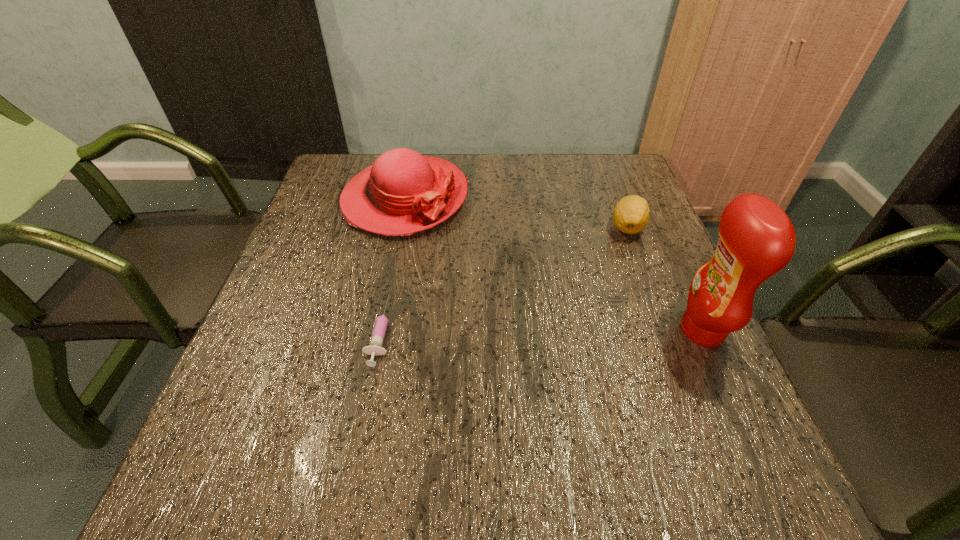
You are a GUI agent. You are given a task and a screenshot of the screen. Output one action in this format:
    pyautogui.click(x=<x>, y=<y>)
    Task: Click on the blank region between the second tallest object and the shortest object
    Image resolution: width=960 pixels, height=540 pixels.
    Given the screenshot: What is the action you would take?
    pyautogui.click(x=393, y=265)

Where is `free area in between the tallest object and the second tallest object`? The image size is (960, 540). free area in between the tallest object and the second tallest object is located at coordinates (554, 265).

The height and width of the screenshot is (540, 960). What are the coordinates of `free area in between the condiment and the third shortest object` in the screenshot? It's located at (554, 265).

Find the location of a particular element. This screenshot has height=540, width=960. blank region between the shortest object and the third shortest object is located at coordinates (393, 265).

Image resolution: width=960 pixels, height=540 pixels. Identify the location of empty space that is in between the syringe and the hat. tap(393, 265).

The width and height of the screenshot is (960, 540). Identify the location of object that can be found as the closest to the syringe. (402, 193).

Identify which object is the third closest to the third tallest object. Please provide its 2D coordinates. Your answer should be formatted as a tuple, i.e. [(x, y)], where the tuple contains the x and y coordinates of a point satisfying the conditions above.

[(375, 348)]

The height and width of the screenshot is (540, 960). What are the coordinates of `vacant position in the image that satisfies the following two spatial constraints: 1. on the back side of the syringe; 2. on the left side of the lemon` in the screenshot? It's located at (401, 227).

Find the location of a particular element. The height and width of the screenshot is (540, 960). free space that satisfies the following two spatial constraints: 1. on the front side of the tallest object; 2. on the label side of the third shortest object is located at coordinates (378, 330).